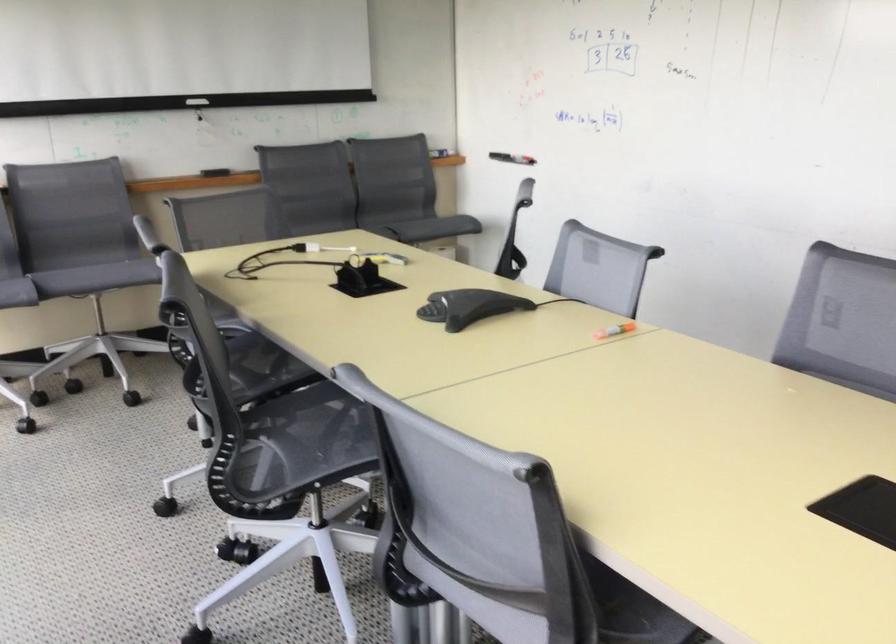
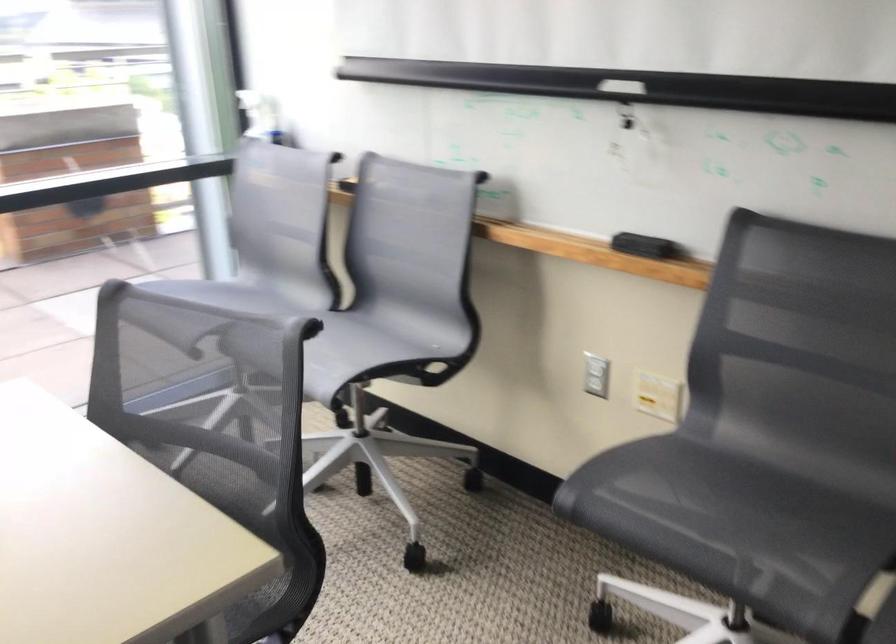
Where in the second image is the point corresponding to point (214, 167) from the first image?

(643, 245)